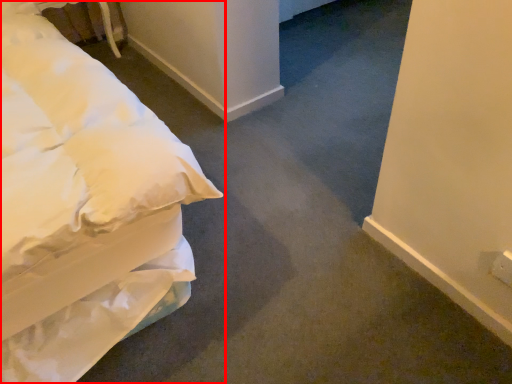
Question: From the image's perspective, where is bed (annotated by the red box) located in relation to table in the image?

Choices:
 (A) above
 (B) below

Answer: (B)